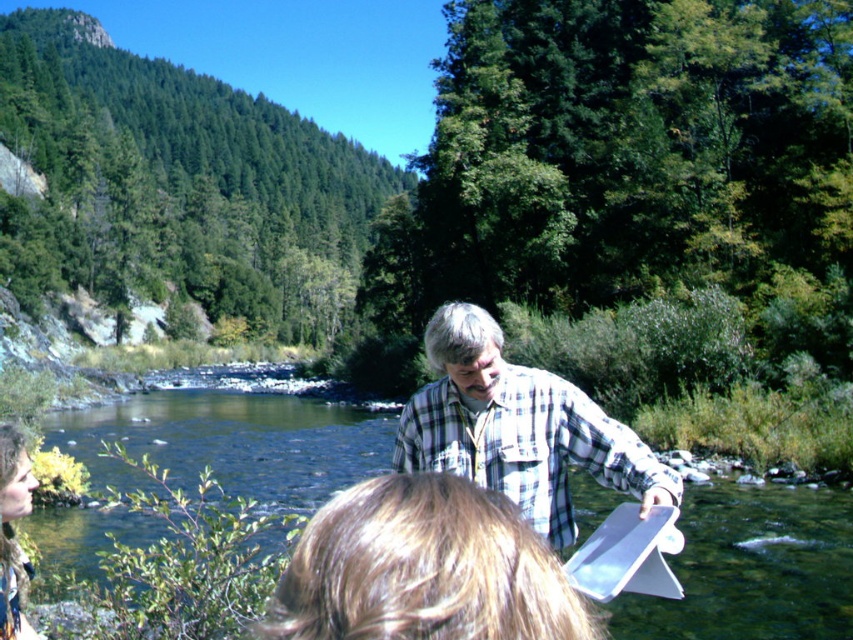
Between point (212, 452) and point (659, 532), which one is positioned in front?

Point (659, 532) is in front.

The width and height of the screenshot is (853, 640). What are the coordinates of `clear water at creek center` in the screenshot? It's located at (753, 566).

Is point (624, 586) closer to camera compared to point (10, 625)?

Yes, point (624, 586) is closer to viewer.

Can you confirm if white paper clipboard at center is positioned below camouflage fabric jacket at lower left?

No, white paper clipboard at center is not below camouflage fabric jacket at lower left.

Is point (666, 572) positioned behind point (10, 634)?

No, (666, 572) is in front of (10, 634).

Where is `white paper clipboard at center`? white paper clipboard at center is located at coordinates (628, 554).

Does clear water at creek center have a larger size compared to blonde hair at center?

Indeed, clear water at creek center has a larger size compared to blonde hair at center.

The image size is (853, 640). What are the coordinates of `clear water at creek center` in the screenshot? It's located at (753, 566).

Where is `clear water at creek center`? This screenshot has height=640, width=853. clear water at creek center is located at coordinates (753, 566).